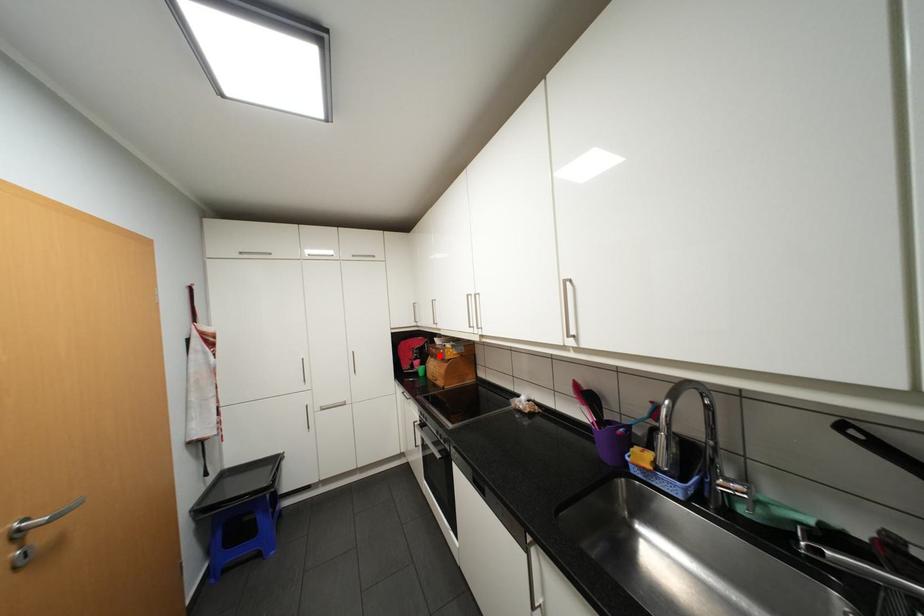
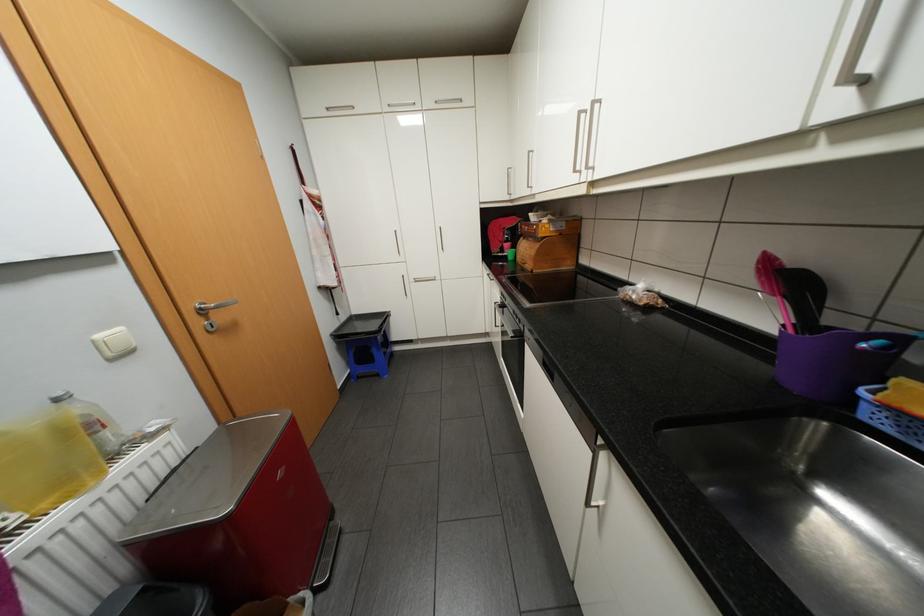
In the second image, find the point that corresponds to the highlighted location in the first image.

(531, 237)